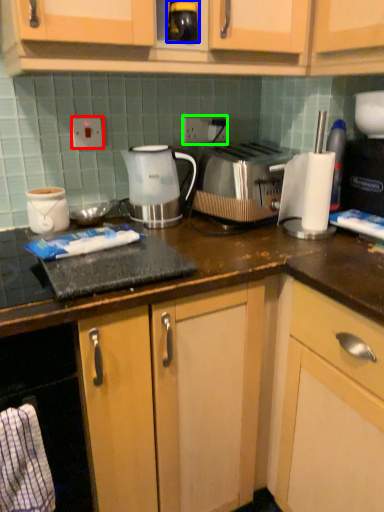
Question: Based on their relative distances, which object is farther from electric outlet (highlighted by a red box)? Choose from beverage (highlighted by a blue box) and electric outlet (highlighted by a green box).

Choices:
 (A) beverage
 (B) electric outlet

Answer: (A)